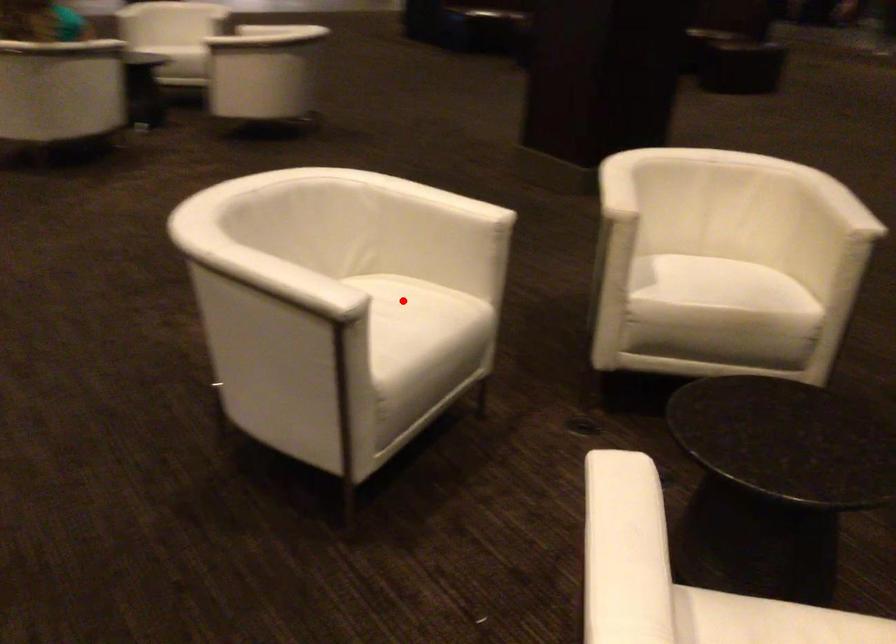
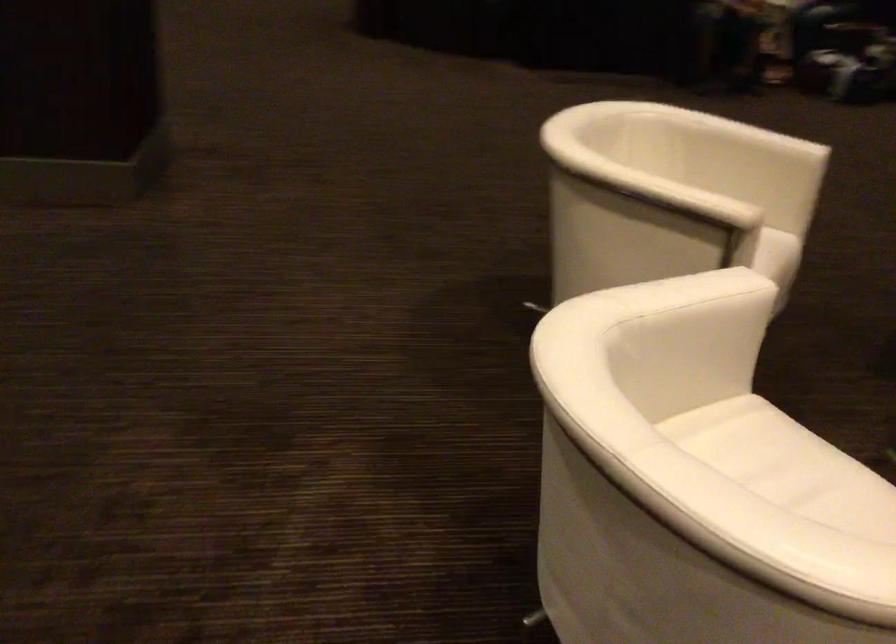
Question: A red point is marked in image1. In image2, is the corresponding 3D point closer to the camera or farther? Reply with the corresponding letter.

Choices:
 (A) The corresponding 3D point is closer.
 (B) The corresponding 3D point is farther.

Answer: (A)